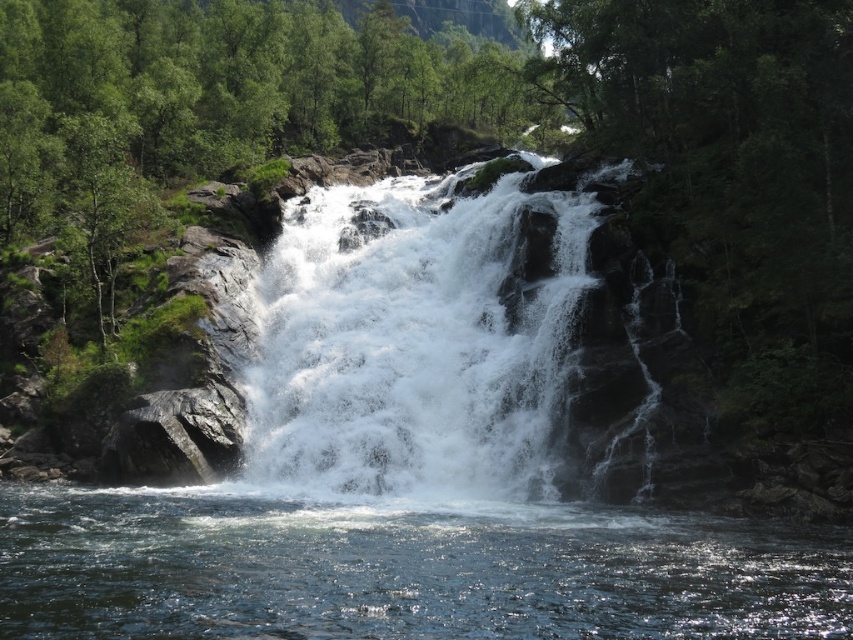
Is point (477, 83) less distant than point (276, 429)?

No, (477, 83) is further to viewer.

Which of these two, green leafy tree at center or white frothy water at center, stands shorter?

white frothy water at center is shorter.

The image size is (853, 640). Identify the location of green leafy tree at center. (221, 106).

The height and width of the screenshot is (640, 853). I want to click on green leafy tree at center, so click(x=221, y=106).

Can you confirm if clear water at center is smaller than white frothy water at center?

Yes, clear water at center is smaller than white frothy water at center.

Who is more distant from viewer, [782,529] or [352,360]?

The point [352,360] is behind.

Which is in front, point (357, 624) or point (448, 380)?

Point (357, 624) is in front.

Locate an element on the screen. This screenshot has width=853, height=640. clear water at center is located at coordinates (402, 568).

This screenshot has height=640, width=853. What are the coordinates of `clear water at center` in the screenshot? It's located at (402, 568).

Does clear water at center appear on the left side of green leafy tree at center?

No, clear water at center is not to the left of green leafy tree at center.

Image resolution: width=853 pixels, height=640 pixels. I want to click on clear water at center, so [402, 568].

At what (x,y) coordinates should I click in order to perform the action: click on clear water at center. Please return your answer as a coordinate pair (x, y). The width and height of the screenshot is (853, 640). Looking at the image, I should click on (402, 568).